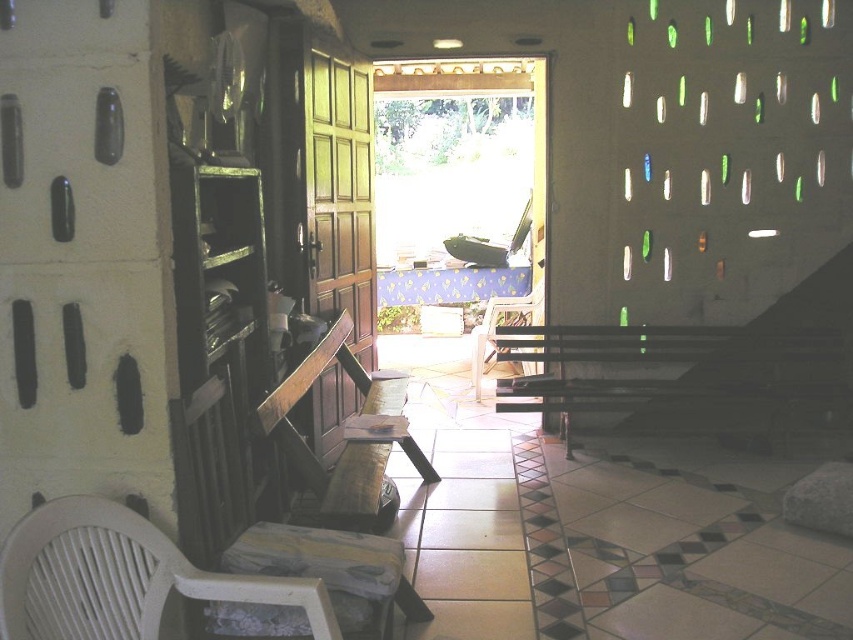
Where is `wooden bench at center`? Image resolution: width=853 pixels, height=640 pixels. wooden bench at center is located at coordinates (346, 436).

Can you confirm if wooden bench at center is wider than wooden chair at center?

Correct, the width of wooden bench at center exceeds that of wooden chair at center.

Does point (338, 458) lie in front of point (471, 352)?

Yes, it is in front of point (471, 352).

You are a GUI agent. You are given a task and a screenshot of the screen. Output one action in this format:
    pyautogui.click(x=<x>, y=<y>)
    Task: Click on the wooden bench at center
    The image size is (853, 640).
    Given the screenshot: What is the action you would take?
    pyautogui.click(x=346, y=436)

Which is more to the right, white plastic rocking chair at lower left or wooden chair at center?

wooden chair at center is more to the right.

Does point (148, 534) lie in front of point (471, 380)?

Yes, point (148, 534) is closer to viewer.

This screenshot has height=640, width=853. In order to click on white plastic rocking chair at lower left in this screenshot , I will do `click(119, 577)`.

Does green wood door at center have a larger size compared to wooden chair at center?

Indeed, green wood door at center has a larger size compared to wooden chair at center.

Is green wood door at center below wooden chair at center?

No, green wood door at center is not below wooden chair at center.

Is point (357, 65) closer to camera compared to point (524, 312)?

Yes, it is in front of point (524, 312).

In order to click on green wood door at center in this screenshot , I will do (340, 195).